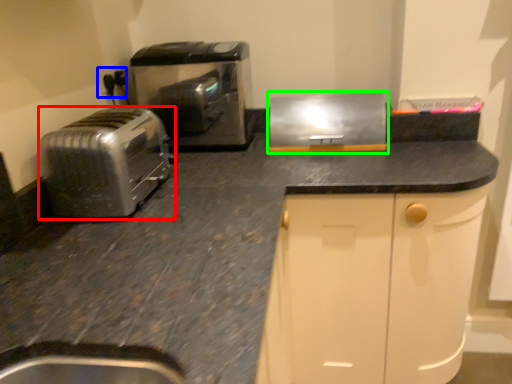
Question: Based on their relative distances, which object is farther from toaster (highlighted by a red box)? Choose from electric outlet (highlighted by a blue box) and kitchen appliance (highlighted by a green box).

Choices:
 (A) electric outlet
 (B) kitchen appliance

Answer: (B)